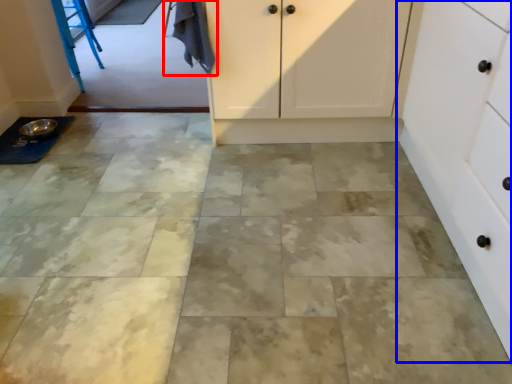
Question: Which object is further to the camera taking this photo, laundry (highlighted by a red box) or cabinetry (highlighted by a blue box)?

Choices:
 (A) laundry
 (B) cabinetry

Answer: (A)